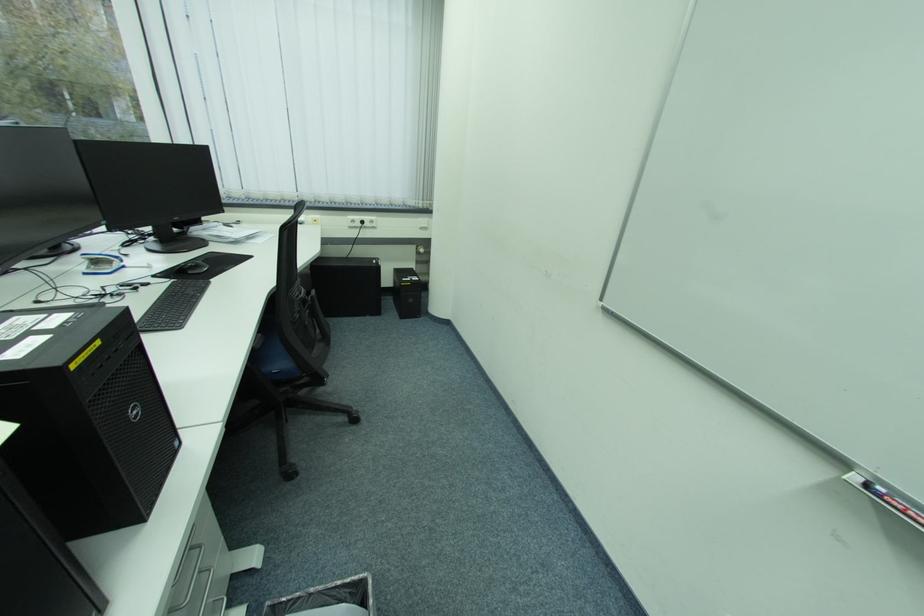
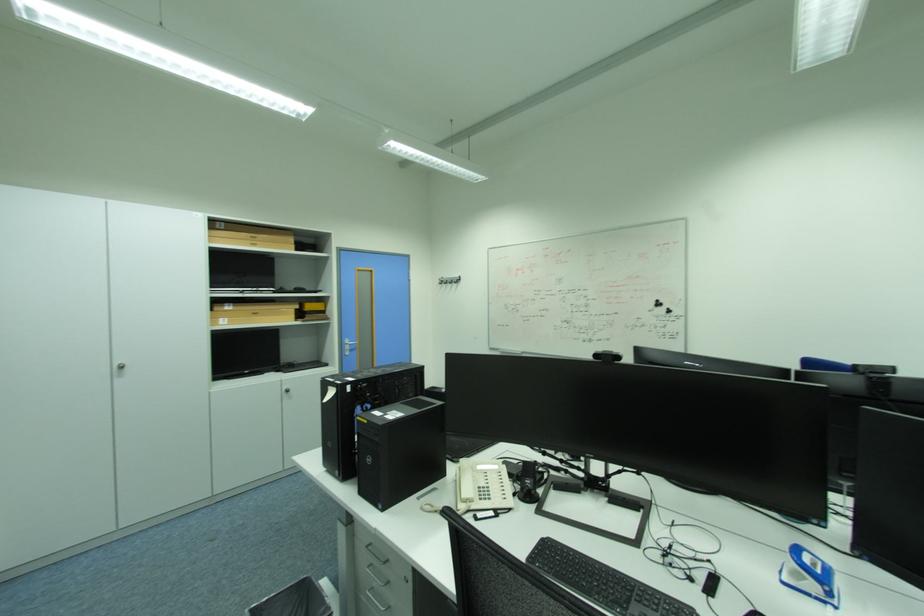
The point at [131,267] is marked in the first image. Where is the corresponding point in the second image?

(833, 604)